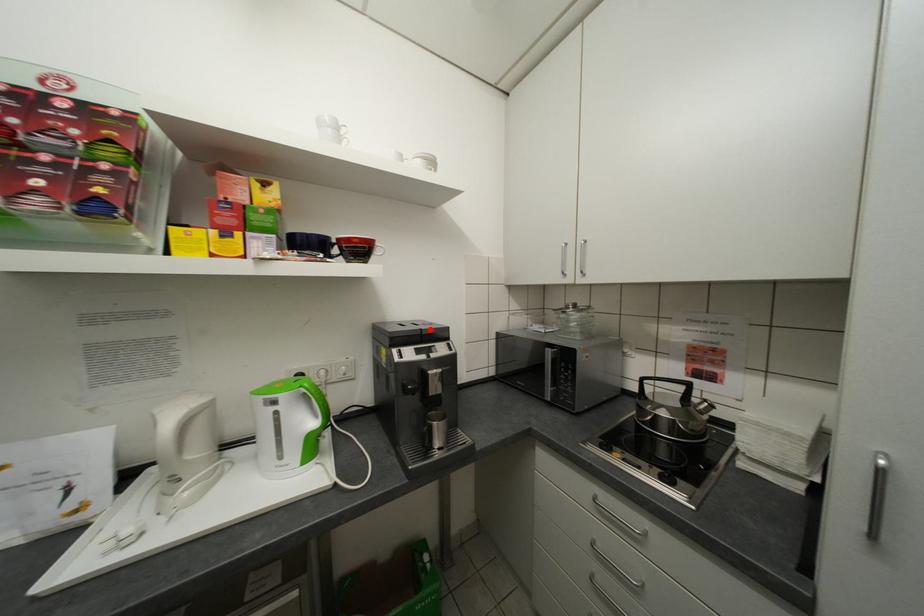
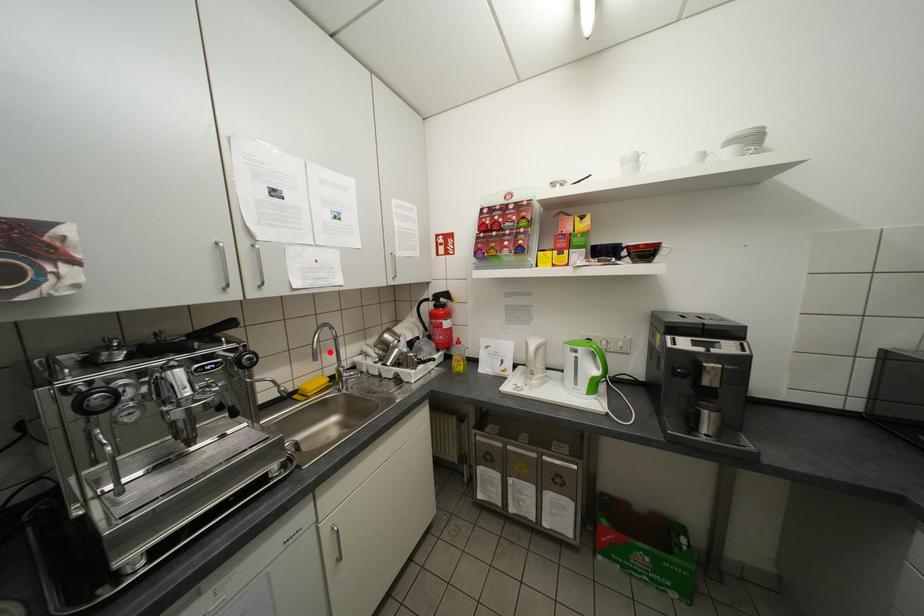
I am providing you with two images of the same scene from different viewpoints. A red point is marked on the first image and another point is marked on the second image. Is the red point in image1 aligned with the point shown in image2?

No